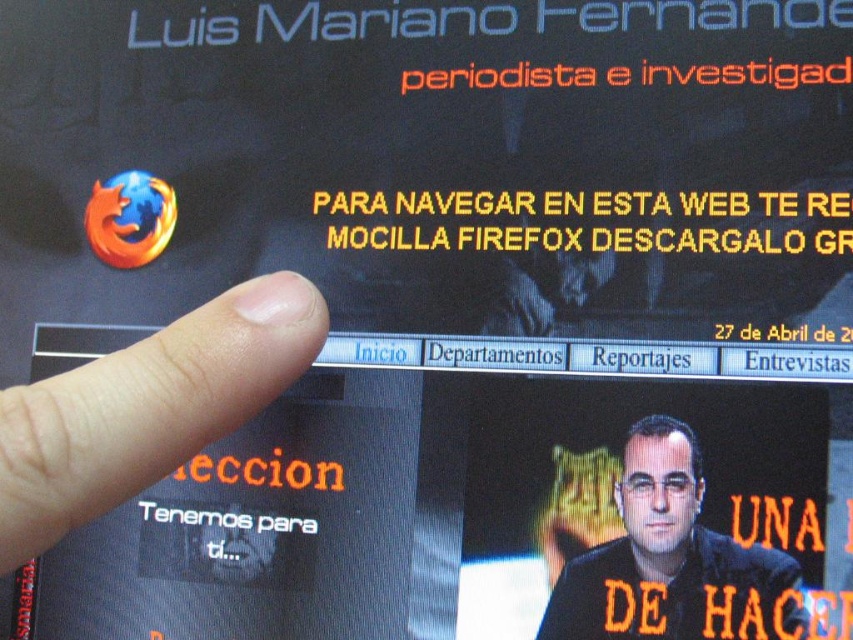
Is flesh-toned skin at lower left below black glossy shirt at lower right?

No, flesh-toned skin at lower left is not below black glossy shirt at lower right.

Between flesh-toned skin at lower left and black glossy shirt at lower right, which one is positioned higher?

Positioned higher is flesh-toned skin at lower left.

Who is more forward, (285, 278) or (648, 541)?

Point (285, 278) is in front.

You are a GUI agent. You are given a task and a screenshot of the screen. Output one action in this format:
    pyautogui.click(x=<x>, y=<y>)
    Task: Click on the flesh-toned skin at lower left
    
    Given the screenshot: What is the action you would take?
    pyautogui.click(x=148, y=408)